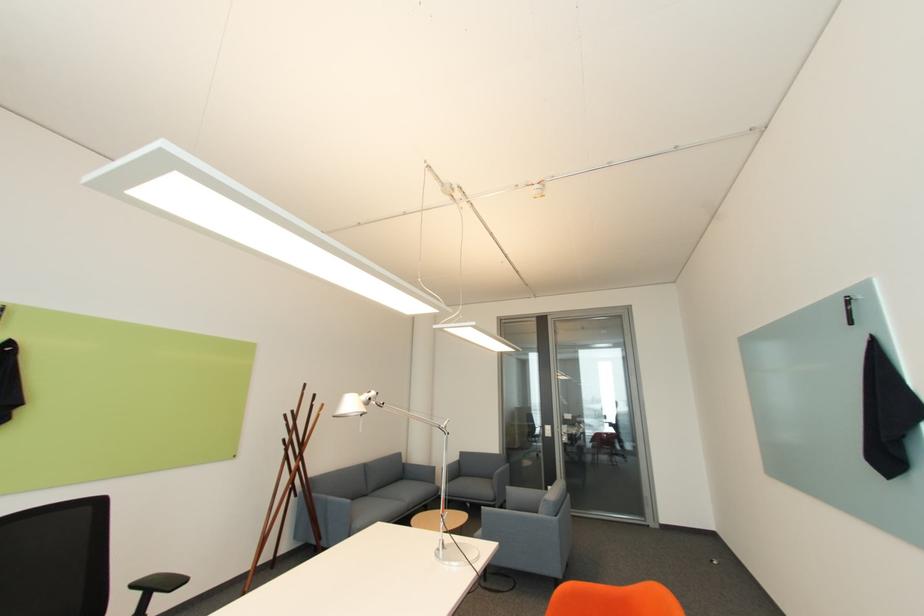
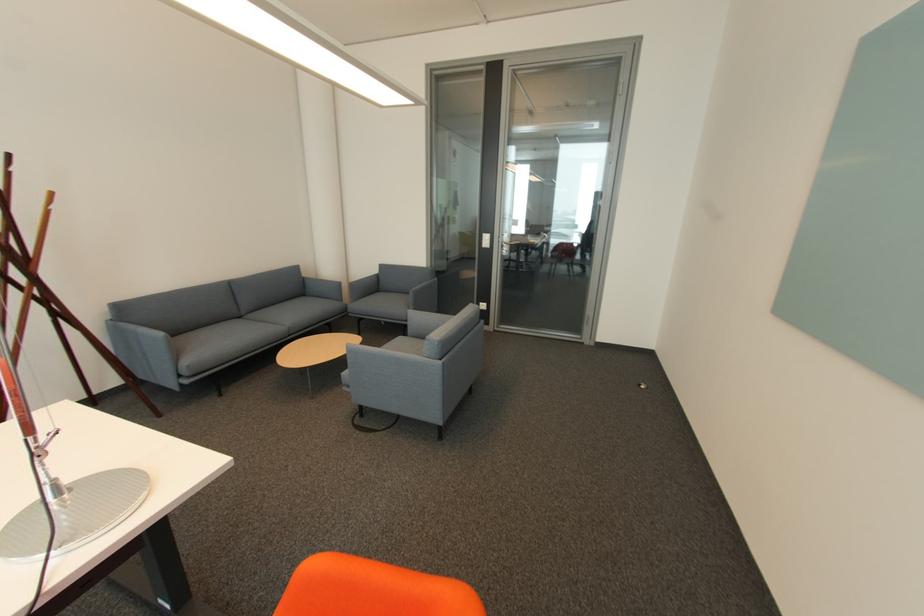
The point at (410, 464) is marked in the first image. Where is the corresponding point in the second image?

(310, 278)